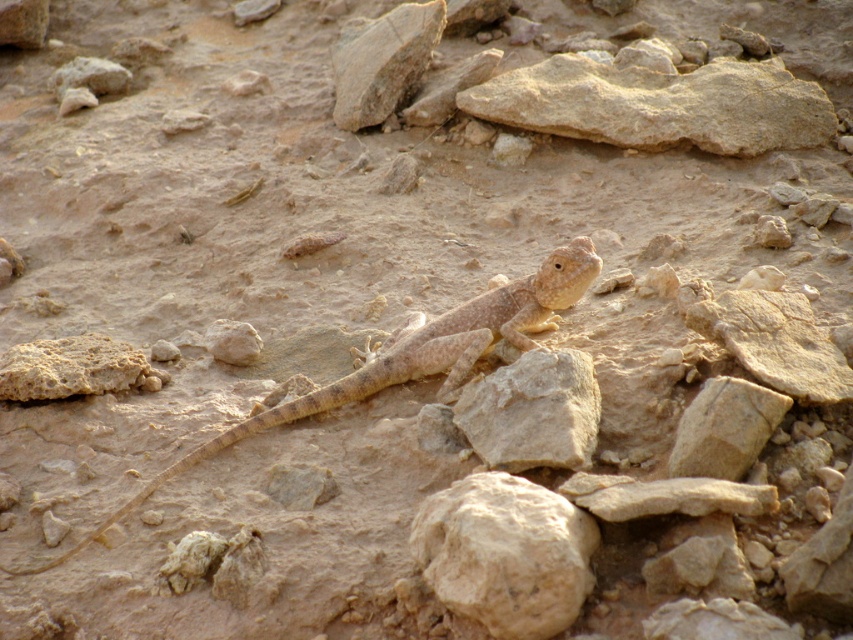
Question: Which of the following is the farthest from the observer?

Choices:
 (A) (578, 552)
 (B) (358, 380)

Answer: (B)

Question: Can you confirm if smooth beige rock at center is smaller than desert-dusted lizard at center?

Choices:
 (A) yes
 (B) no

Answer: (A)

Question: Which point appears closest to the camera in this image?

Choices:
 (A) (444, 385)
 (B) (495, 536)

Answer: (B)

Question: Can you confirm if smooth beige rock at center is bigger than desert-dusted lizard at center?

Choices:
 (A) no
 (B) yes

Answer: (A)

Question: Does smooth beige rock at center have a greater width compared to desert-dusted lizard at center?

Choices:
 (A) yes
 (B) no

Answer: (B)

Question: Among these objects, which one is farthest from the camera?

Choices:
 (A) smooth beige rock at center
 (B) desert-dusted lizard at center

Answer: (B)